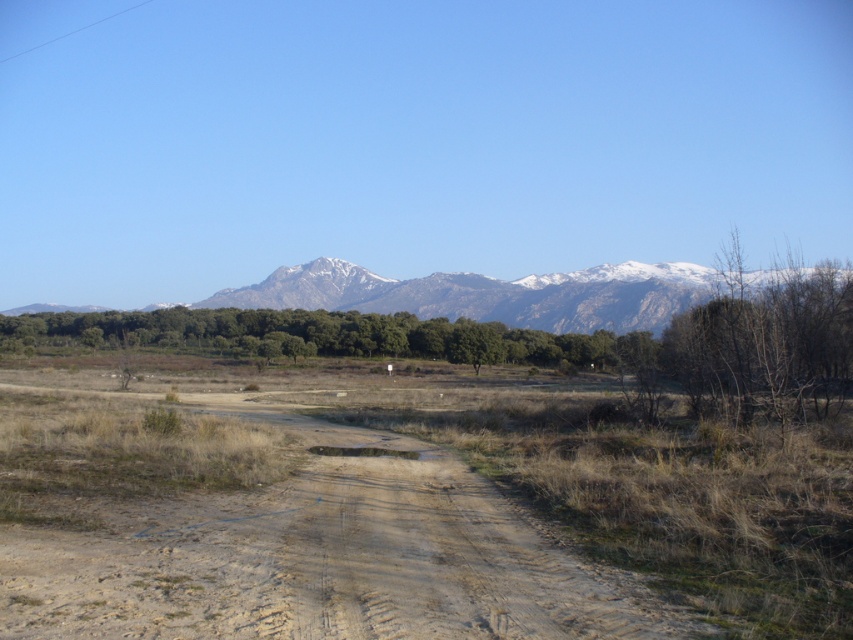
Who is lower down, brown sandy dirt track at center or snowy granite mountain range at upper center?

brown sandy dirt track at center

Is brown sandy dirt track at center to the left of snowy granite mountain range at upper center from the viewer's perspective?

Correct, you'll find brown sandy dirt track at center to the left of snowy granite mountain range at upper center.

Which is in front, point (492, 538) or point (518, 314)?

Point (492, 538) is in front.

Find the location of a particular element. Image resolution: width=853 pixels, height=640 pixels. brown sandy dirt track at center is located at coordinates (321, 556).